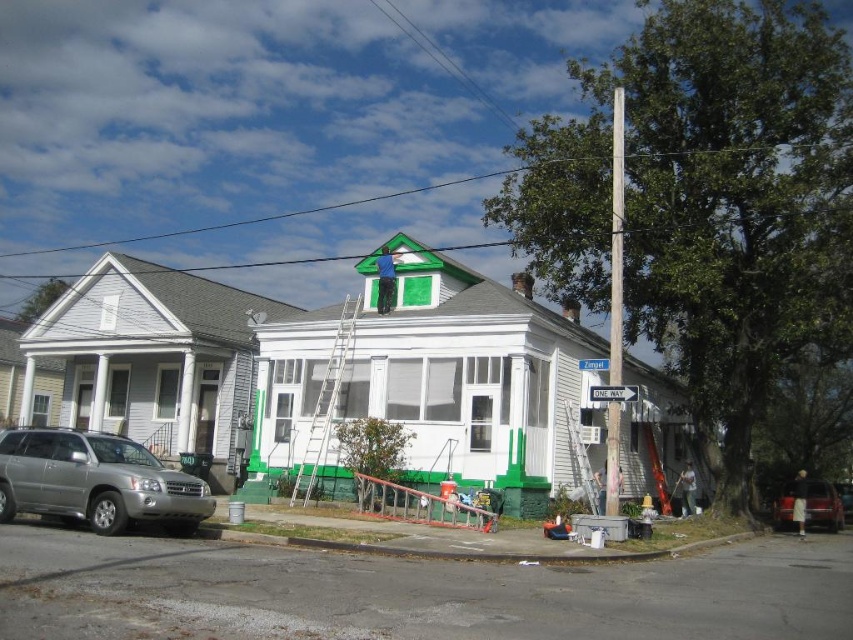
Can you confirm if silver metallic suv at lower left is wider than white plastic street sign at upper center?

Correct, the width of silver metallic suv at lower left exceeds that of white plastic street sign at upper center.

Does point (70, 474) lie in front of point (630, 392)?

Yes, it is.

This screenshot has height=640, width=853. In order to click on silver metallic suv at lower left in this screenshot , I will do `click(96, 481)`.

Can you confirm if silver metallic suv at lower left is shorter than blue plastic street sign at upper center?

Incorrect, silver metallic suv at lower left's height does not fall short of blue plastic street sign at upper center's.

Is silver metallic suv at lower left behind blue plastic street sign at upper center?

No.

This screenshot has height=640, width=853. I want to click on silver metallic suv at lower left, so pyautogui.click(x=96, y=481).

Where is `silver metallic suv at lower left`? This screenshot has width=853, height=640. silver metallic suv at lower left is located at coordinates (96, 481).

Who is lower down, smooth wood pole at right or blue plastic street sign at upper center?

blue plastic street sign at upper center is lower down.

Is smooth wood pole at right below blue plastic street sign at upper center?

No.

Is point (605, 509) more distant than point (596, 368)?

No, (605, 509) is in front of (596, 368).

The image size is (853, 640). In order to click on smooth wood pole at right in this screenshot , I will do `click(616, 237)`.